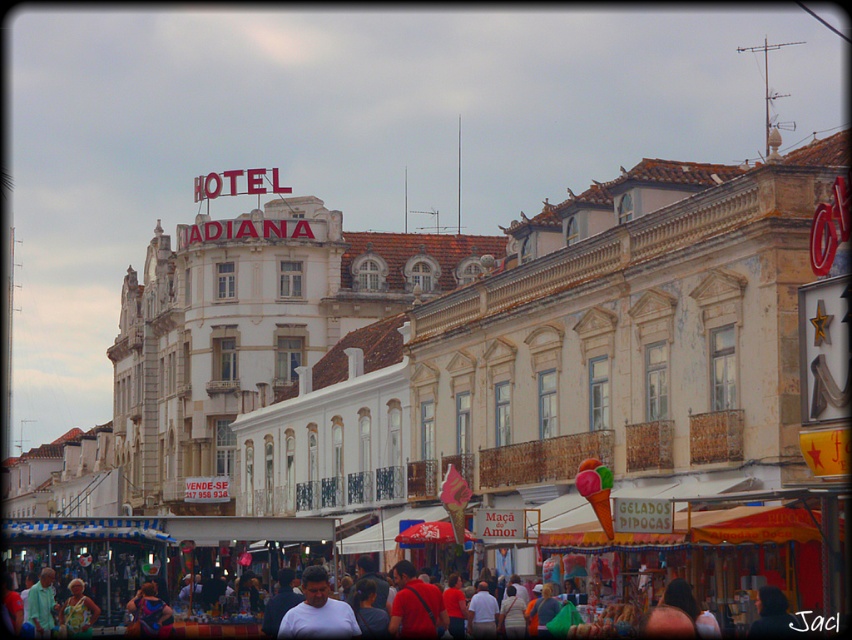
Question: Among these objects, which one is farthest from the camera?

Choices:
 (A) white matte shirt at center
 (B) red fabric shirt at center
 (C) floral printed dress at center

Answer: (C)

Question: Can you confirm if white matte shirt at center is wider than floral printed dress at center?

Choices:
 (A) yes
 (B) no

Answer: (A)

Question: Which is nearer to the floral printed dress at center?

Choices:
 (A) red fabric shirt at center
 (B) white matte shirt at center

Answer: (B)

Question: Is white matte shirt at center further to camera compared to floral printed dress at center?

Choices:
 (A) no
 (B) yes

Answer: (A)

Question: Is red fabric shirt at center bigger than floral printed dress at center?

Choices:
 (A) no
 (B) yes

Answer: (B)

Question: Considering the real-world distances, which object is farthest from the floral printed dress at center?

Choices:
 (A) red fabric shirt at center
 (B) white matte shirt at center

Answer: (A)